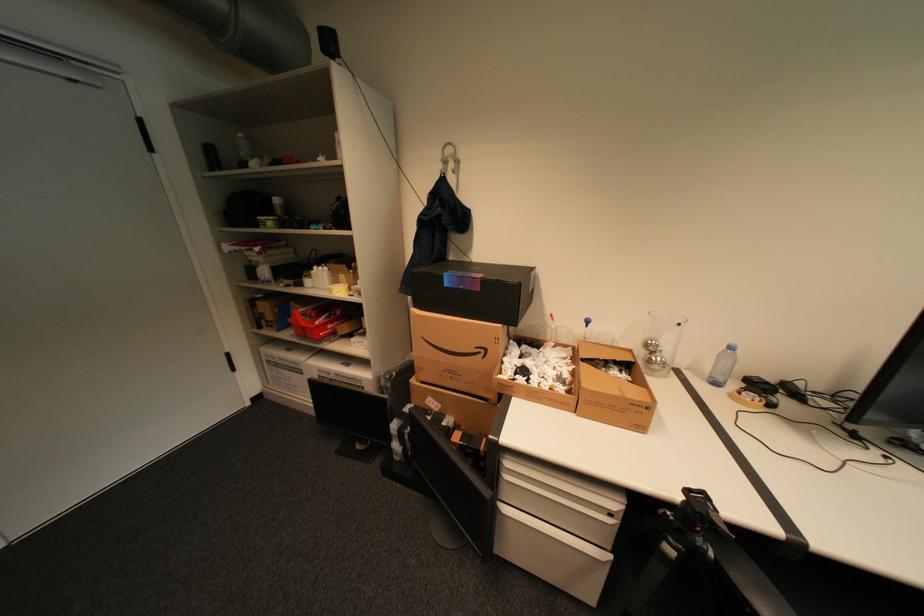
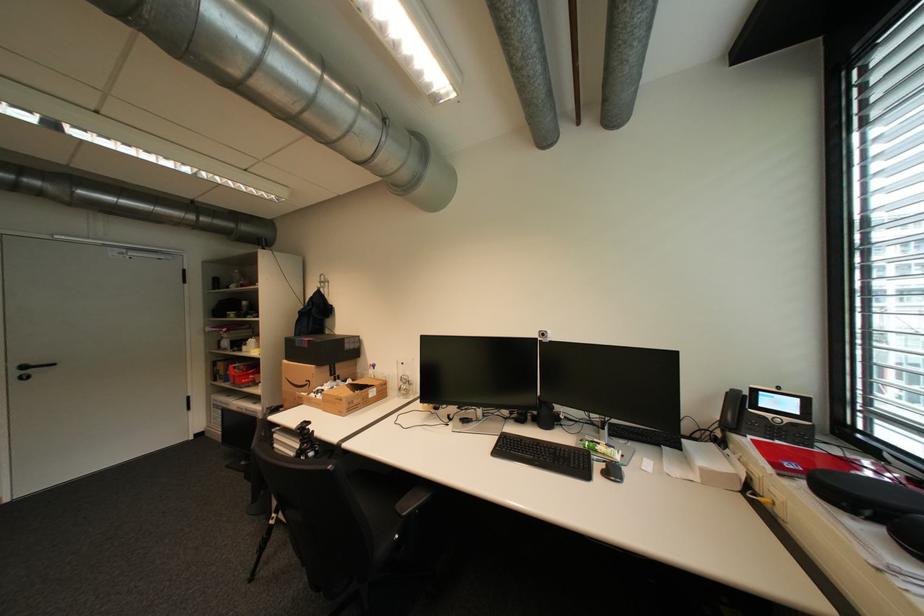
In the second image, find the point that corresponds to point 492,352 in the first image.

(317, 383)